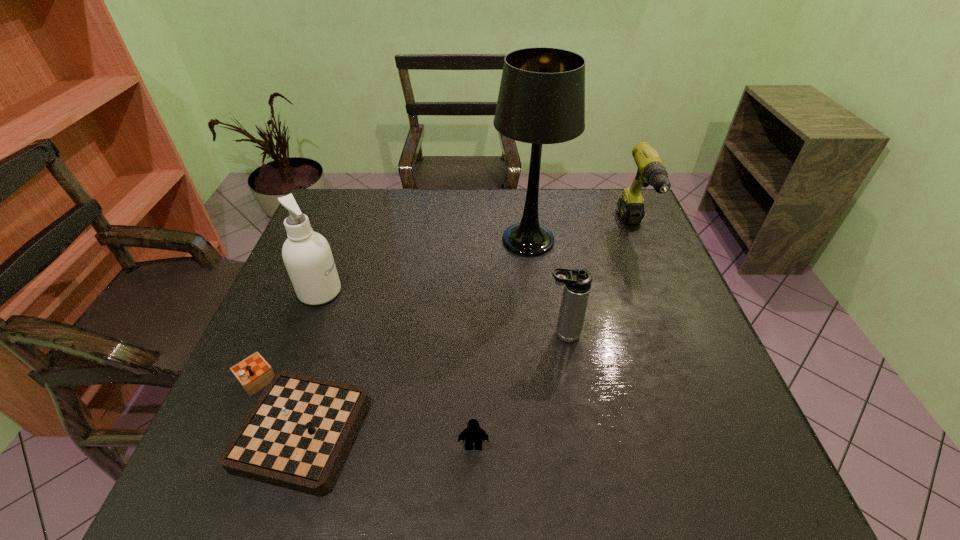
This screenshot has width=960, height=540. Find the location of `chessboard located at the near edge`. chessboard located at the near edge is located at coordinates (296, 436).

Locate an element on the screen. cleansing agent located in the left edge section of the desktop is located at coordinates (307, 255).

This screenshot has width=960, height=540. In order to click on chessboard present at the left edge in this screenshot , I will do `click(296, 436)`.

Locate an element on the screen. The height and width of the screenshot is (540, 960). object at the right edge is located at coordinates (651, 171).

Identify the location of object located at the near left corner. The width and height of the screenshot is (960, 540). (296, 436).

The height and width of the screenshot is (540, 960). In order to click on object that is positioned at the far right corner in this screenshot , I will do `click(651, 171)`.

Where is `vacant space at the far edge`? vacant space at the far edge is located at coordinates (384, 192).

This screenshot has height=540, width=960. What are the coordinates of `free spot at the near edge of the desktop` in the screenshot? It's located at (417, 494).

Image resolution: width=960 pixels, height=540 pixels. In order to click on free space at the right edge in this screenshot , I will do `click(629, 285)`.

Find the location of `free space at the far left corner`. free space at the far left corner is located at coordinates (332, 199).